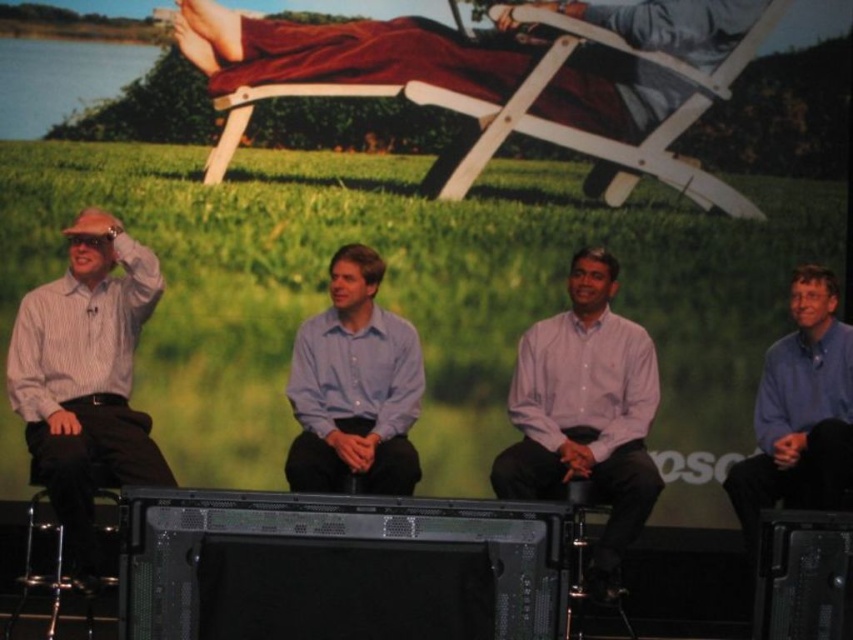
Does striped cotton shirt at left come in front of white wood beach chair at upper center?

Yes.

From the picture: Can you confirm if striped cotton shirt at left is positioned above white wood beach chair at upper center?

Actually, striped cotton shirt at left is below white wood beach chair at upper center.

Is point (108, 468) more distant than point (537, 68)?

No, (108, 468) is closer to viewer.

You are a GUI agent. You are given a task and a screenshot of the screen. Output one action in this format:
    pyautogui.click(x=<x>, y=<y>)
    Task: Click on the striped cotton shirt at left
    The width and height of the screenshot is (853, 640).
    Given the screenshot: What is the action you would take?
    tap(85, 378)

Which is behind, point (376, 380) or point (779, 468)?

Positioned behind is point (376, 380).

Locate an element on the screen. The width and height of the screenshot is (853, 640). light blue shirt at center is located at coordinates (354, 387).

Measure the distance from pink cotton shirt at center to light blue shirt at center.

pink cotton shirt at center and light blue shirt at center are 25.25 inches apart from each other.

Who is taller, pink cotton shirt at center or light blue shirt at center?

With more height is pink cotton shirt at center.

Locate an element on the screen. The image size is (853, 640). pink cotton shirt at center is located at coordinates (585, 412).